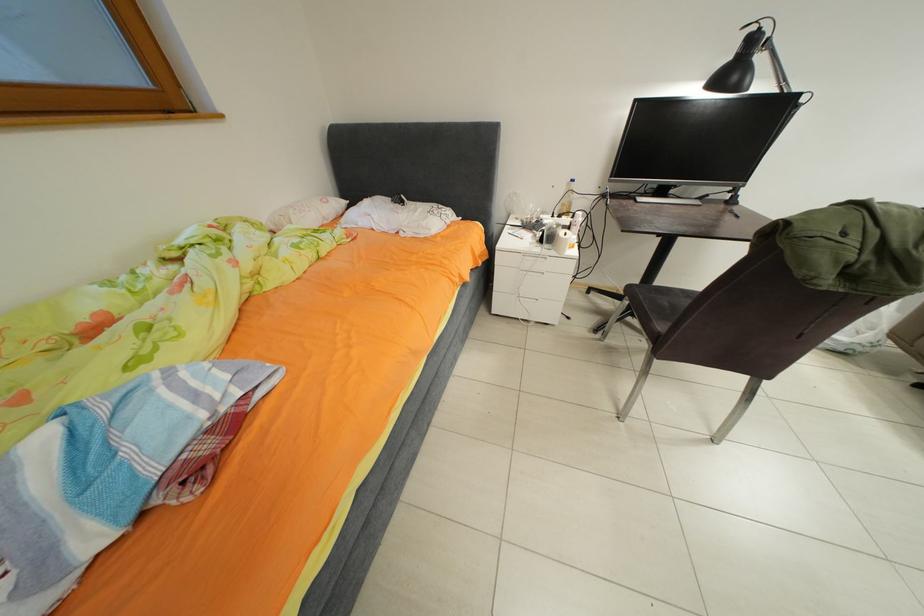
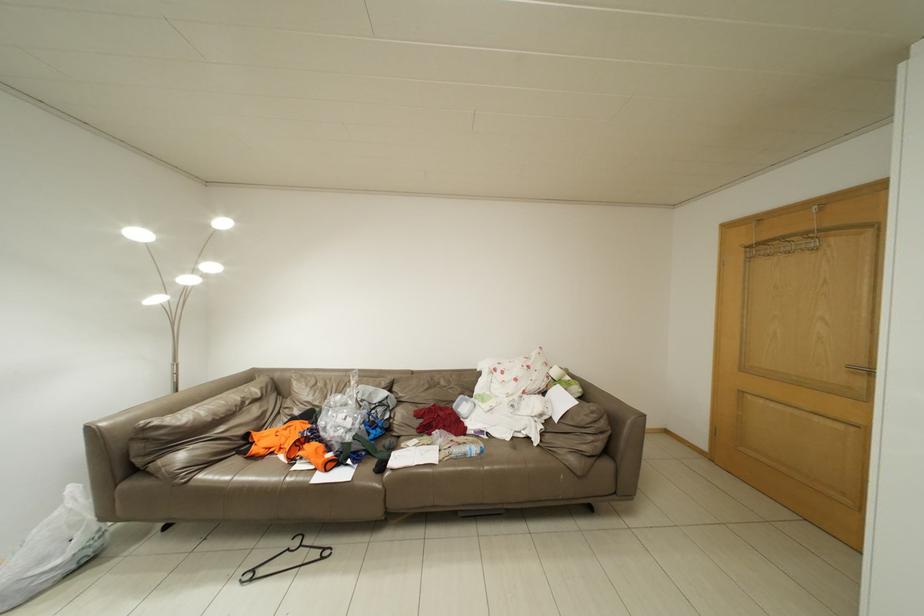
Question: The first image is from the beginning of the video and the second image is from the end. How did the camera likely rotate when shooting the video?

Choices:
 (A) Left
 (B) Right
 (C) Up
 (D) Down

Answer: (B)